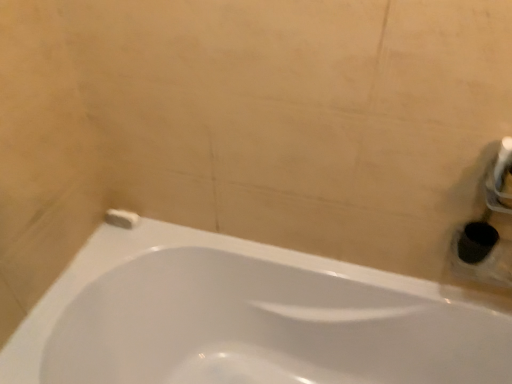
Locate an element on the screen. This screenshot has width=512, height=384. white matte toilet paper at lower left is located at coordinates (122, 218).

What do you see at coordinates (122, 218) in the screenshot? I see `white matte toilet paper at lower left` at bounding box center [122, 218].

The width and height of the screenshot is (512, 384). Identify the location of white glossy bathtub at lower left. (245, 319).

What do you see at coordinates (245, 319) in the screenshot? This screenshot has width=512, height=384. I see `white glossy bathtub at lower left` at bounding box center [245, 319].

The image size is (512, 384). What are the coordinates of `white matte toilet paper at lower left` in the screenshot? It's located at (122, 218).

Considering the positions of objects white glossy bathtub at lower left and white matte toilet paper at lower left in the image provided, who is more to the right, white glossy bathtub at lower left or white matte toilet paper at lower left?

white glossy bathtub at lower left.

Considering the relative positions of white glossy bathtub at lower left and white matte toilet paper at lower left in the image provided, is white glossy bathtub at lower left behind white matte toilet paper at lower left?

No, it is in front of white matte toilet paper at lower left.

Does point (309, 357) come closer to viewer compared to point (109, 220)?

Yes, point (309, 357) is closer to viewer.

From the image's perspective, which object appears higher, white glossy bathtub at lower left or white matte toilet paper at lower left?

white matte toilet paper at lower left appears higher in the image.

From a real-world perspective, is white glossy bathtub at lower left positioned above or below white matte toilet paper at lower left?

Clearly, from a real-world perspective, white glossy bathtub at lower left is below white matte toilet paper at lower left.

Considering the sizes of white glossy bathtub at lower left and white matte toilet paper at lower left in the image, is white glossy bathtub at lower left wider or thinner than white matte toilet paper at lower left?

Considering their sizes, white glossy bathtub at lower left looks broader than white matte toilet paper at lower left.

Does white glossy bathtub at lower left have a greater height compared to white matte toilet paper at lower left?

Yes, white glossy bathtub at lower left is taller than white matte toilet paper at lower left.

Does white glossy bathtub at lower left have a smaller size compared to white matte toilet paper at lower left?

Actually, white glossy bathtub at lower left might be larger than white matte toilet paper at lower left.

Is white glossy bathtub at lower left located outside white matte toilet paper at lower left?

Indeed, white glossy bathtub at lower left is completely outside white matte toilet paper at lower left.

Are white glossy bathtub at lower left and white matte toilet paper at lower left making contact?

No, white glossy bathtub at lower left is not beside white matte toilet paper at lower left.

Is white glossy bathtub at lower left positioned with its back to white matte toilet paper at lower left?

white glossy bathtub at lower left does not have its back to white matte toilet paper at lower left.

You are a GUI agent. You are given a task and a screenshot of the screen. Output one action in this format:
    pyautogui.click(x=<x>, y=<y>)
    Task: Click on the toilet paper above the white glossy bathtub at lower left (from the image's perspective)
    This screenshot has height=384, width=512.
    Given the screenshot: What is the action you would take?
    pyautogui.click(x=122, y=218)

Considering the positions of objects white matte toilet paper at lower left and white glossy bathtub at lower left in the image provided, who is more to the right, white matte toilet paper at lower left or white glossy bathtub at lower left?

From the viewer's perspective, white glossy bathtub at lower left appears more on the right side.

Which is behind, white matte toilet paper at lower left or white glossy bathtub at lower left?

Positioned behind is white matte toilet paper at lower left.

Is point (134, 217) closer or farther from the camera than point (183, 378)?

Point (134, 217) appears to be farther away from the viewer than point (183, 378).

From the image's perspective, is white matte toilet paper at lower left over white glossy bathtub at lower left?

Yes, from the image's perspective, white matte toilet paper at lower left is on top of white glossy bathtub at lower left.

From a real-world perspective, is white matte toilet paper at lower left on top of white glossy bathtub at lower left?

Yes, from a real-world perspective, white matte toilet paper at lower left is on top of white glossy bathtub at lower left.

Between white matte toilet paper at lower left and white glossy bathtub at lower left, which one has smaller width?

white matte toilet paper at lower left is thinner.

Considering the relative sizes of white matte toilet paper at lower left and white glossy bathtub at lower left in the image provided, is white matte toilet paper at lower left taller than white glossy bathtub at lower left?

No.

Considering the sizes of objects white matte toilet paper at lower left and white glossy bathtub at lower left in the image provided, who is bigger, white matte toilet paper at lower left or white glossy bathtub at lower left?

white glossy bathtub at lower left.

Is white matte toilet paper at lower left not inside white glossy bathtub at lower left?

Yes, white matte toilet paper at lower left is located beyond the bounds of white glossy bathtub at lower left.

Can you see white matte toilet paper at lower left touching white glossy bathtub at lower left?

They are not placed beside each other.

Looking at this image, is white matte toilet paper at lower left oriented away from white glossy bathtub at lower left?

No, white matte toilet paper at lower left is not facing away from white glossy bathtub at lower left.

What's the angular difference between white matte toilet paper at lower left and white glossy bathtub at lower left's facing directions?

0.00255 degrees.

The width and height of the screenshot is (512, 384). Find the location of `toilet paper on the left of white glossy bathtub at lower left`. toilet paper on the left of white glossy bathtub at lower left is located at coordinates (122, 218).

Find the location of a particular element. This screenshot has width=512, height=384. bathtub below the white matte toilet paper at lower left (from the image's perspective) is located at coordinates (245, 319).

This screenshot has height=384, width=512. What are the coordinates of `bathtub below the white matte toilet paper at lower left (from a real-world perspective)` in the screenshot? It's located at (245, 319).